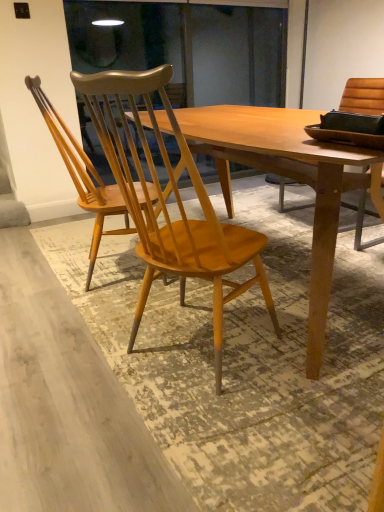
The width and height of the screenshot is (384, 512). Find the location of `vacant area that lies in front of light brown wood chair at center, which ranks as the first chair in left-to-right order`. vacant area that lies in front of light brown wood chair at center, which ranks as the first chair in left-to-right order is located at coordinates (112, 312).